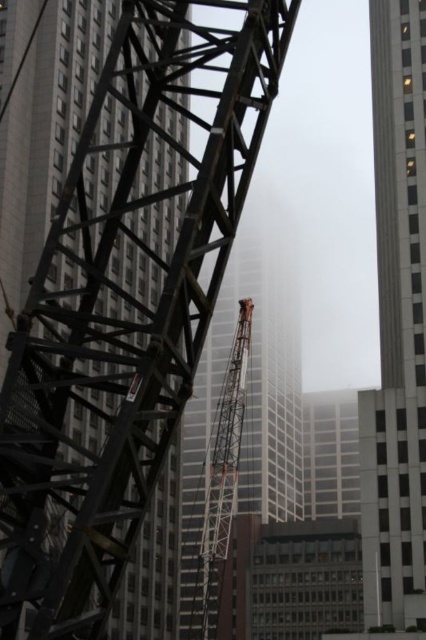
You are a delivery drone that needs to fly through the space between the metallic scaffolding at left and the orange metallic crane at center. Can you safely pass through this area?

The metallic scaffolding at left is above the orange metallic crane at center, so there is vertical clearance for the drone to pass safely underneath the scaffolding and above the crane.

You are a drone operator trying to deliver a package to the top of the white glass skyscraper at right. You notice a point at coordinates (397, 321) in the image. Is this point on the white glass skyscraper at right?

Yes, the point (397, 321) is on the white glass skyscraper at right, so the drone can target that location for delivery.